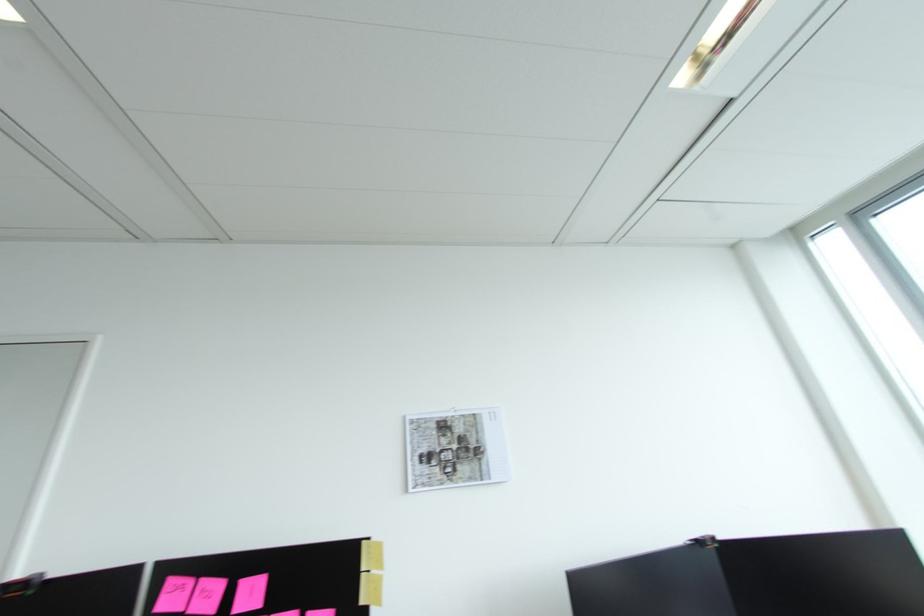
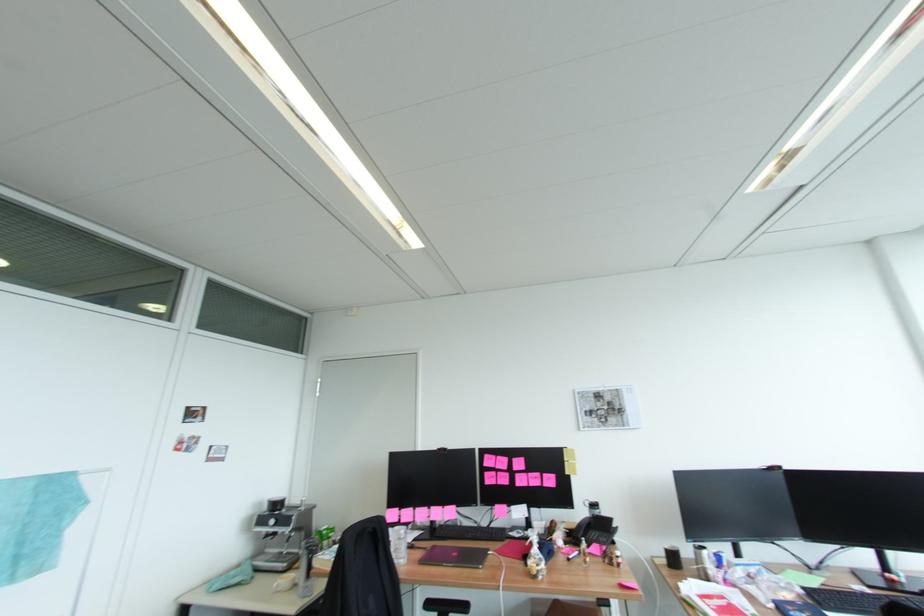
In the second image, find the point that corresponds to (176,582) in the first image.

(492, 456)